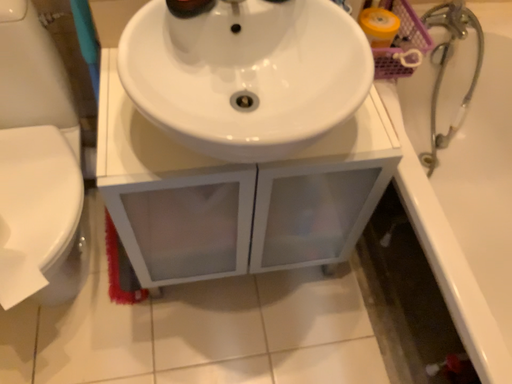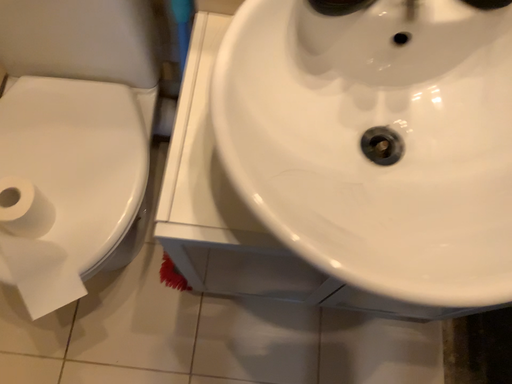
Question: How did the camera likely rotate when shooting the video?

Choices:
 (A) rotated downward
 (B) rotated upward

Answer: (A)